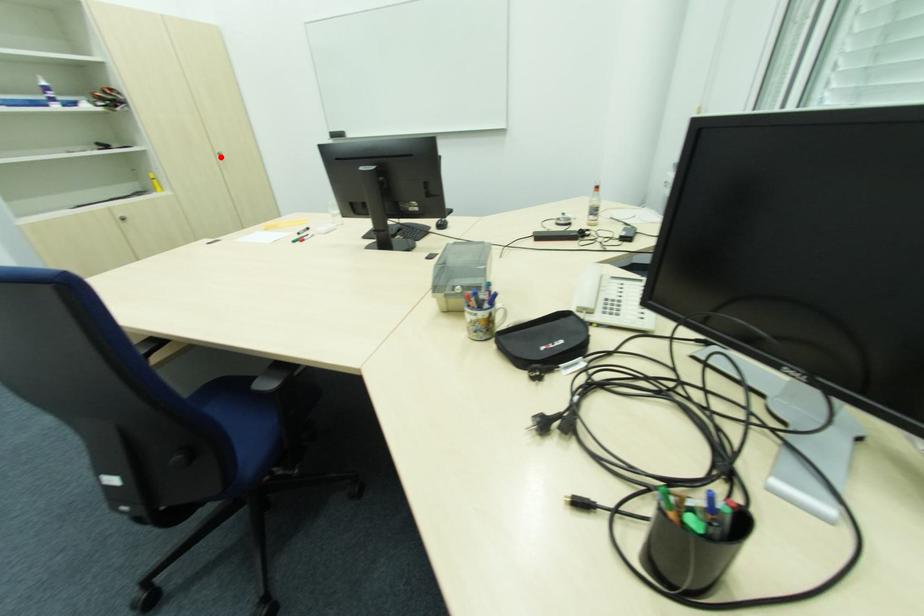
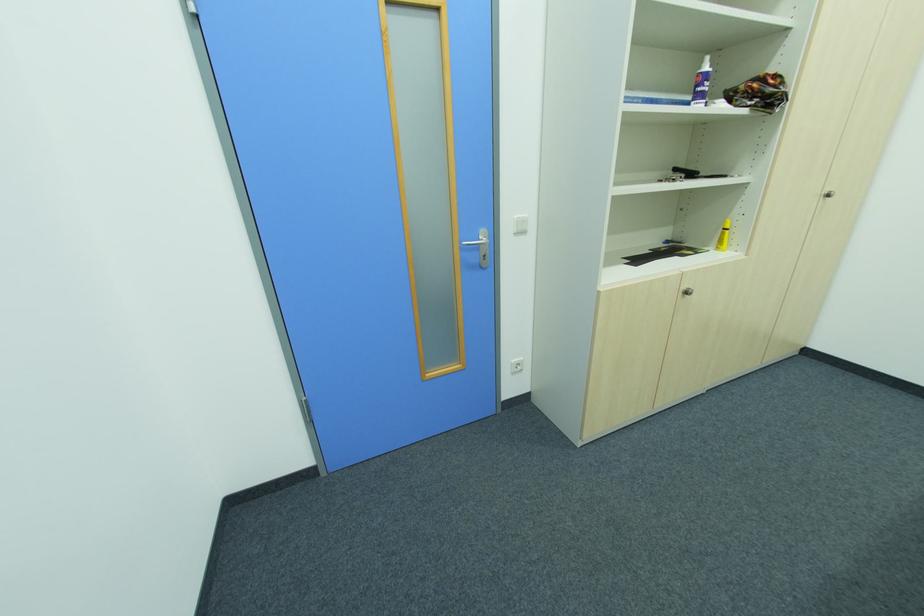
Find the pixel in the second image that matches the highlighted location in the first image.

(822, 198)